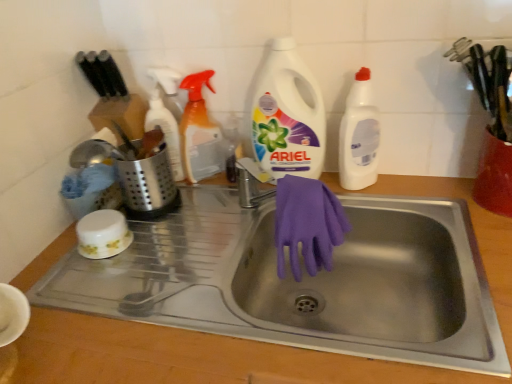
Locate an element on the screen. This screenshot has height=384, width=512. free space in front of white plastic bottle at upper right, which is counted as the fourth cleaning product, starting from the left is located at coordinates (396, 212).